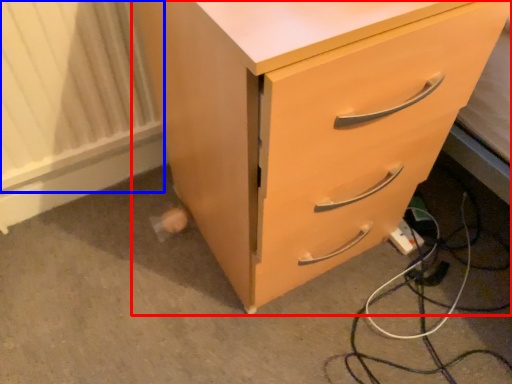
Question: Among these objects, which one is nearest to the camera, chest of drawers (highlighted by a red box) or radiator (highlighted by a blue box)?

Choices:
 (A) chest of drawers
 (B) radiator

Answer: (A)